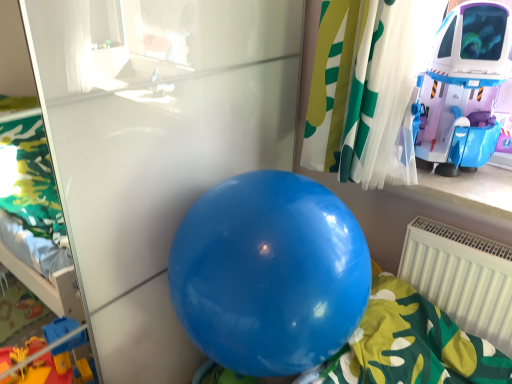
The image size is (512, 384). In order to click on white plastic radiator at lower right in this screenshot , I will do `click(462, 277)`.

This screenshot has width=512, height=384. What do you see at coordinates (269, 273) in the screenshot? I see `glossy blue balloon at center` at bounding box center [269, 273].

From the picture: In order to face shiny plastic spaceship at upper right, should I rotate leftwards or rightwards?

Rotate your view right by about 28.042°.

Where is `white plastic radiator at lower right`? The image size is (512, 384). white plastic radiator at lower right is located at coordinates (462, 277).

Is point (232, 189) closer to viewer compared to point (454, 272)?

Yes.

From the picture: Does glossy blue balloon at center have a smaller size compared to white plastic radiator at lower right?

No.

Which is more to the right, glossy blue balloon at center or white plastic radiator at lower right?

From the viewer's perspective, white plastic radiator at lower right appears more on the right side.

How much distance is there between glossy blue balloon at center and white plastic radiator at lower right?

glossy blue balloon at center and white plastic radiator at lower right are 21.81 inches apart.

Is shiny plastic spaceship at upper right positioned with its back to glossy blue balloon at center?

No, shiny plastic spaceship at upper right's orientation is not away from glossy blue balloon at center.

Would you say shiny plastic spaceship at upper right contains glossy blue balloon at center?

No, glossy blue balloon at center is located outside of shiny plastic spaceship at upper right.

Measure the distance from shiny plastic spaceship at upper right to glossy blue balloon at center.

The distance of shiny plastic spaceship at upper right from glossy blue balloon at center is 25.89 inches.

Is point (456, 53) closer or farther from the camera than point (310, 242)?

Point (456, 53) is positioned farther from the camera compared to point (310, 242).

Considering the relative sizes of glossy blue balloon at center and shiny plastic spaceship at upper right in the image provided, is glossy blue balloon at center bigger than shiny plastic spaceship at upper right?

Correct, glossy blue balloon at center is larger in size than shiny plastic spaceship at upper right.

Is the depth of glossy blue balloon at center greater than that of shiny plastic spaceship at upper right?

No, glossy blue balloon at center is in front of shiny plastic spaceship at upper right.

Can you confirm if glossy blue balloon at center is taller than shiny plastic spaceship at upper right?

Correct, glossy blue balloon at center is much taller as shiny plastic spaceship at upper right.

The width and height of the screenshot is (512, 384). Identify the location of toy lying above the glossy blue balloon at center (from the image's perspective). (465, 87).

Is shiny plastic spaceship at upper right placed right next to white plastic radiator at lower right?

No, shiny plastic spaceship at upper right is not beside white plastic radiator at lower right.

Considering the sizes of objects shiny plastic spaceship at upper right and white plastic radiator at lower right in the image provided, who is wider, shiny plastic spaceship at upper right or white plastic radiator at lower right?

shiny plastic spaceship at upper right is wider.

From the image's perspective, is shiny plastic spaceship at upper right under white plastic radiator at lower right?

No, from the image's perspective, shiny plastic spaceship at upper right is not below white plastic radiator at lower right.

How many degrees apart are the facing directions of shiny plastic spaceship at upper right and white plastic radiator at lower right?

There is a 29.6-degree angle between the facing directions of shiny plastic spaceship at upper right and white plastic radiator at lower right.

Does point (466, 299) come behind point (336, 283)?

Yes.

Considering the sizes of objects white plastic radiator at lower right and glossy blue balloon at center in the image provided, who is wider, white plastic radiator at lower right or glossy blue balloon at center?

glossy blue balloon at center.

Does white plastic radiator at lower right come behind glossy blue balloon at center?

Yes, white plastic radiator at lower right is behind glossy blue balloon at center.

Looking at this image, does white plastic radiator at lower right have a greater width compared to shiny plastic spaceship at upper right?

Incorrect, the width of white plastic radiator at lower right does not surpass that of shiny plastic spaceship at upper right.

From the picture: Does white plastic radiator at lower right have a larger size compared to shiny plastic spaceship at upper right?

Actually, white plastic radiator at lower right might be smaller than shiny plastic spaceship at upper right.

Is white plastic radiator at lower right positioned behind shiny plastic spaceship at upper right?

Yes, it is.

From the picture: How distant is white plastic radiator at lower right from shiny plastic spaceship at upper right?

38.41 centimeters.

What are the coordinates of `radiator behind the glossy blue balloon at center` in the screenshot? It's located at (462, 277).

You are a GUI agent. You are given a task and a screenshot of the screen. Output one action in this format:
    pyautogui.click(x=<x>, y=<y>)
    Task: Click on the balloon below the shiny plastic spaceship at upper right (from a real-world perspective)
    
    Given the screenshot: What is the action you would take?
    pyautogui.click(x=269, y=273)

Looking at this image, when comparing their distances from white plastic radiator at lower right, does glossy blue balloon at center or shiny plastic spaceship at upper right seem closer?

shiny plastic spaceship at upper right is positioned closer to the anchor white plastic radiator at lower right.

When comparing their distances from shiny plastic spaceship at upper right, does glossy blue balloon at center or white plastic radiator at lower right seem further?

glossy blue balloon at center is positioned further to the anchor shiny plastic spaceship at upper right.

Looking at the image, which one is located further to glossy blue balloon at center, white plastic radiator at lower right or shiny plastic spaceship at upper right?

shiny plastic spaceship at upper right lies further to glossy blue balloon at center than the other object.

Based on the photo, estimate the real-world distances between objects in this image. Which object is further from white plastic radiator at lower right, shiny plastic spaceship at upper right or glossy blue balloon at center?

Based on the image, glossy blue balloon at center appears to be further to white plastic radiator at lower right.

From the picture: Estimate the real-world distances between objects in this image. Which object is closer to glossy blue balloon at center, shiny plastic spaceship at upper right or white plastic radiator at lower right?

white plastic radiator at lower right.

Considering their positions, is white plastic radiator at lower right positioned further to shiny plastic spaceship at upper right than glossy blue balloon at center?

Among the two, glossy blue balloon at center is located further to shiny plastic spaceship at upper right.

I want to click on toy located between glossy blue balloon at center and white plastic radiator at lower right in the left-right direction, so click(x=465, y=87).